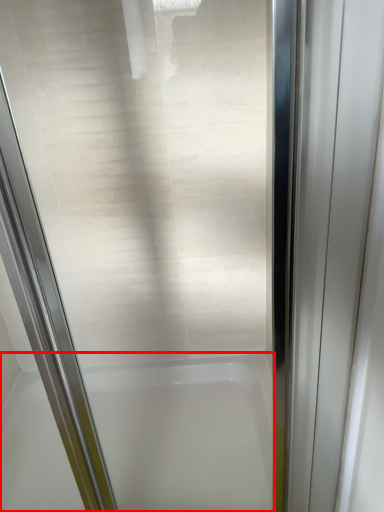
Question: From the image's perspective, where is bathtub (annotated by the red box) located in relation to elevator door in the image?

Choices:
 (A) above
 (B) below

Answer: (B)